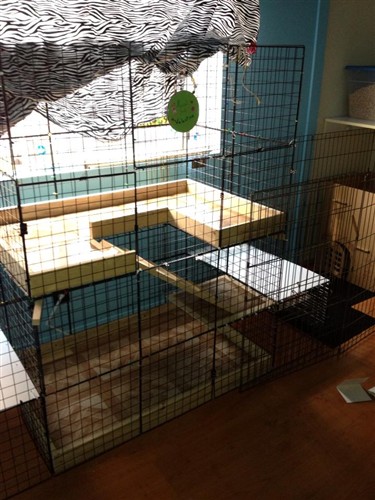
Where is `wall`? The width and height of the screenshot is (375, 500). wall is located at coordinates (284, 39).